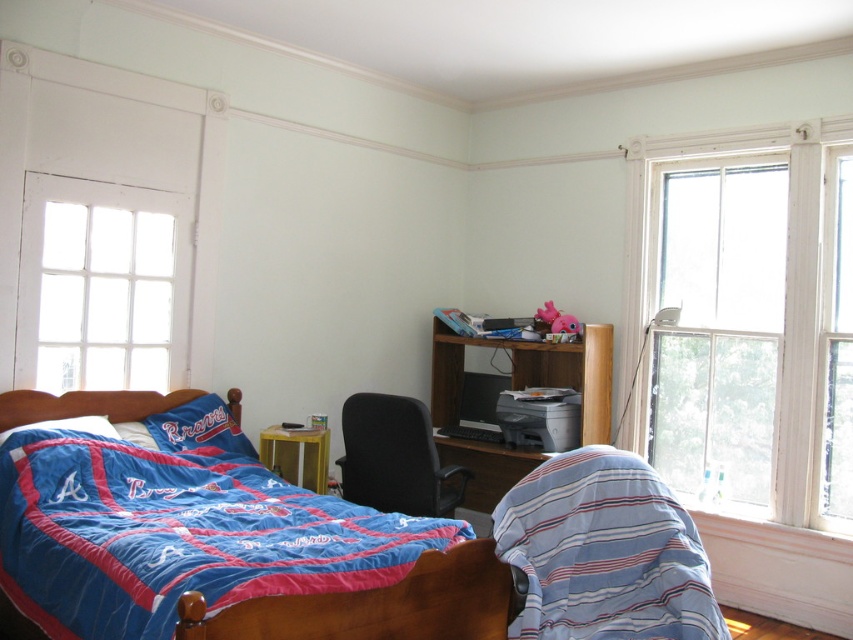
You are a student who needs to sit at the desk to study. Based on the scene description, where is the black fabric chair at center located in relation to the wooden desk at center?

The black fabric chair at center is behind the wooden desk at center, so you would sit by pulling it forward from behind the desk.

Based on the photo, you are sitting in the black fabric chair at center and want to reach the wooden desk at center. Which direction should you move to get to the desk?

You should move to your right because the wooden desk at center is positioned on the right side of the black fabric chair at center.